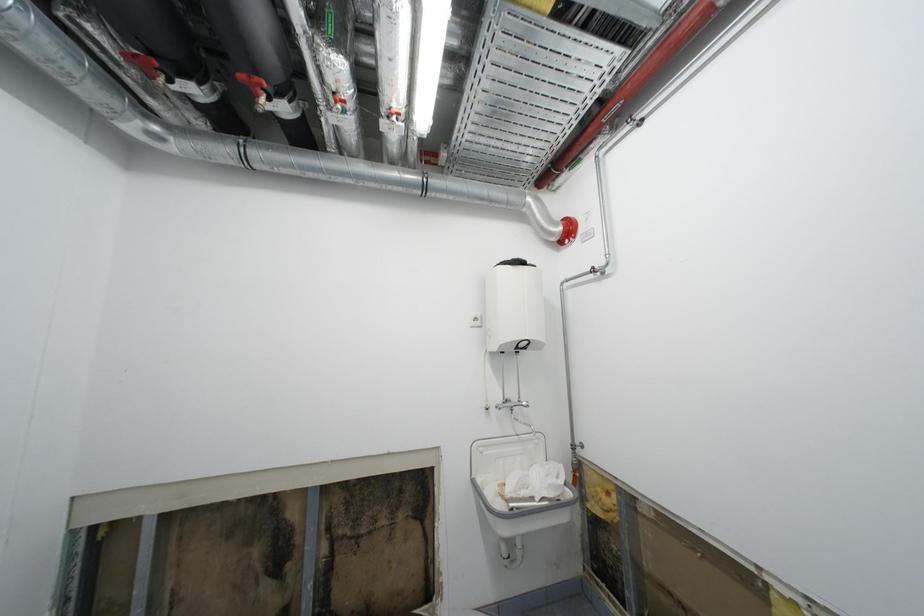
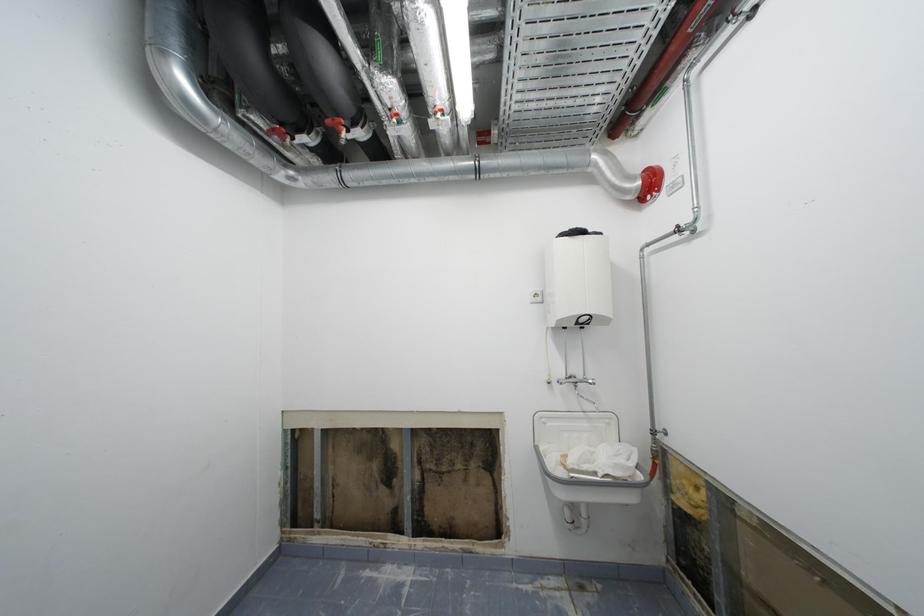
Question: What movement of the cameraman would produce the second image?

Choices:
 (A) Left
 (B) Right
 (C) Forward
 (D) Backward

Answer: (B)